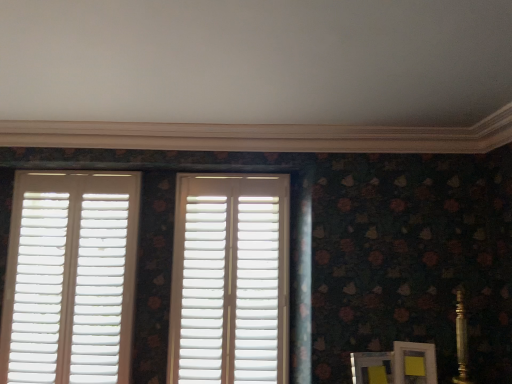
Question: Considering the positions of point (13, 334) and point (254, 309), is point (13, 334) closer or farther from the camera than point (254, 309)?

Choices:
 (A) closer
 (B) farther

Answer: (B)

Question: From a real-world perspective, is white matte shutters at left, positioned as the 2th window in right-to-left order, positioned above or below white matte shutters at center, arranged as the first window when viewed from the right?

Choices:
 (A) above
 (B) below

Answer: (B)

Question: Choose the correct answer: Is white matte shutters at left, positioned as the 2th window in right-to-left order, inside white matte shutters at center, the second window viewed from the left, or outside it?

Choices:
 (A) outside
 (B) inside

Answer: (A)

Question: Relative to white matte shutters at left, positioned as the 2th window in right-to-left order, is white matte shutters at center, arranged as the first window when viewed from the right, in front or behind?

Choices:
 (A) front
 (B) behind

Answer: (A)

Question: Is white matte shutters at center, the second window viewed from the left, bigger or smaller than white matte shutters at left, positioned as the 2th window in right-to-left order?

Choices:
 (A) small
 (B) big

Answer: (A)

Question: From a real-world perspective, is white matte shutters at center, the second window viewed from the left, positioned above or below white matte shutters at left, positioned as the 2th window in right-to-left order?

Choices:
 (A) below
 (B) above

Answer: (B)

Question: From the image's perspective, is white matte shutters at center, arranged as the first window when viewed from the right, located above or below white matte shutters at left, the 1th window viewed from the left?

Choices:
 (A) below
 (B) above

Answer: (B)